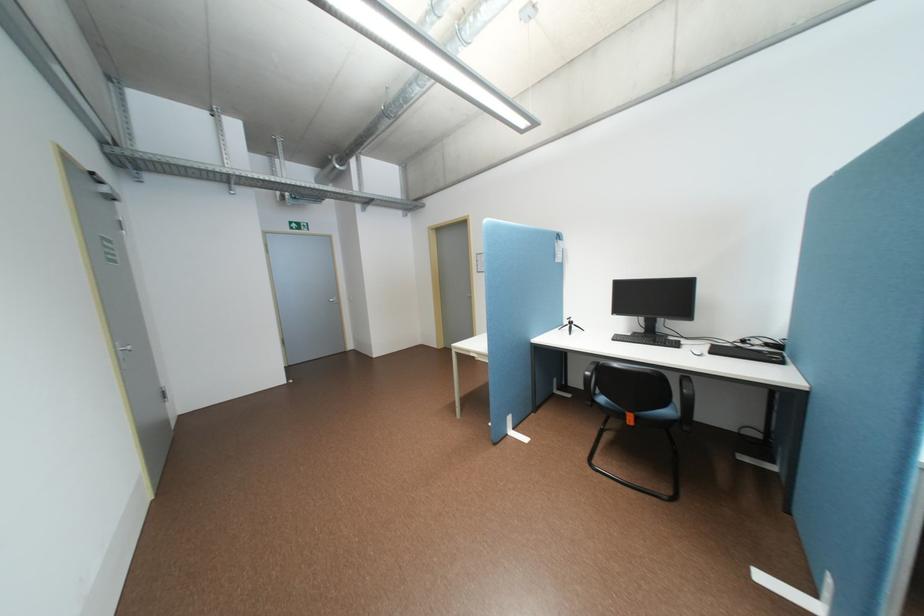
Describe the element at coordinates (687, 390) in the screenshot. I see `a black chair armrest` at that location.